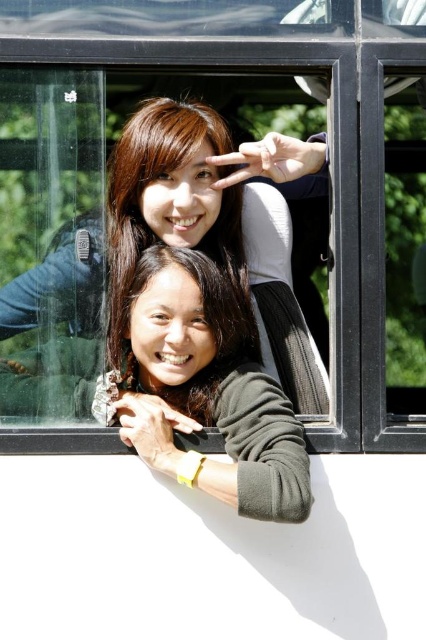
Is point (195, 320) positioned before point (192, 168)?

Yes, point (195, 320) is in front of point (192, 168).

Who is lower down, dark green sweater at center or matte green sweater at center?

dark green sweater at center is lower down.

Locate an element on the screen. dark green sweater at center is located at coordinates (210, 387).

Find the location of `dark green sweater at center`. dark green sweater at center is located at coordinates (210, 387).

Who is more forward, (x=158, y=134) or (x=117, y=248)?

Point (x=158, y=134) is more forward.

Based on the photo, can you confirm if matte black sweater at upper center is positioned to the right of matte green sweater at center?

Correct, you'll find matte black sweater at upper center to the right of matte green sweater at center.

This screenshot has height=640, width=426. Find the location of `matte black sweater at upper center`. matte black sweater at upper center is located at coordinates (169, 243).

You are a GUI agent. You are given a task and a screenshot of the screen. Output one action in this format:
    pyautogui.click(x=<x>, y=<y>)
    Task: Click on the matte black sweater at upper center
    This screenshot has height=640, width=426.
    Given the screenshot: What is the action you would take?
    pyautogui.click(x=169, y=243)

Is matte black sweater at upper center further to the viewer compared to dark green sweater at center?

That is True.

Does matte black sweater at upper center appear under dark green sweater at center?

No.

Which is in front, point (206, 195) or point (224, 433)?

Point (224, 433)

Image resolution: width=426 pixels, height=640 pixels. Find the location of `matte black sweater at upper center`. matte black sweater at upper center is located at coordinates (169, 243).